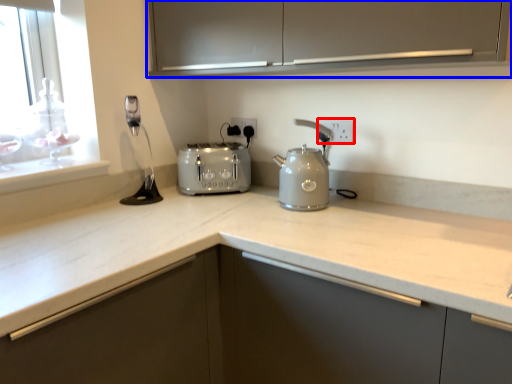
Question: Which of the following is the farthest to the observer, electric outlet (highlighted by a red box) or cabinetry (highlighted by a blue box)?

Choices:
 (A) electric outlet
 (B) cabinetry

Answer: (A)